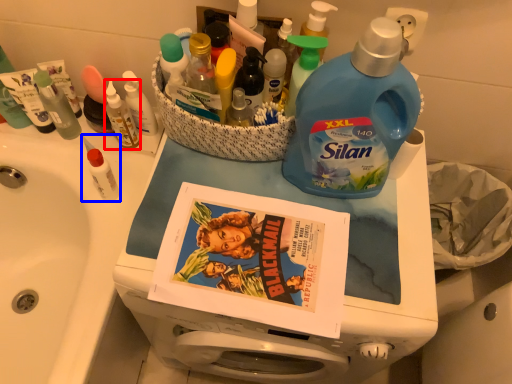
Question: Which point is closer to the camera, toiletry (highlighted by a red box) or toiletry (highlighted by a blue box)?

Choices:
 (A) toiletry
 (B) toiletry

Answer: (B)